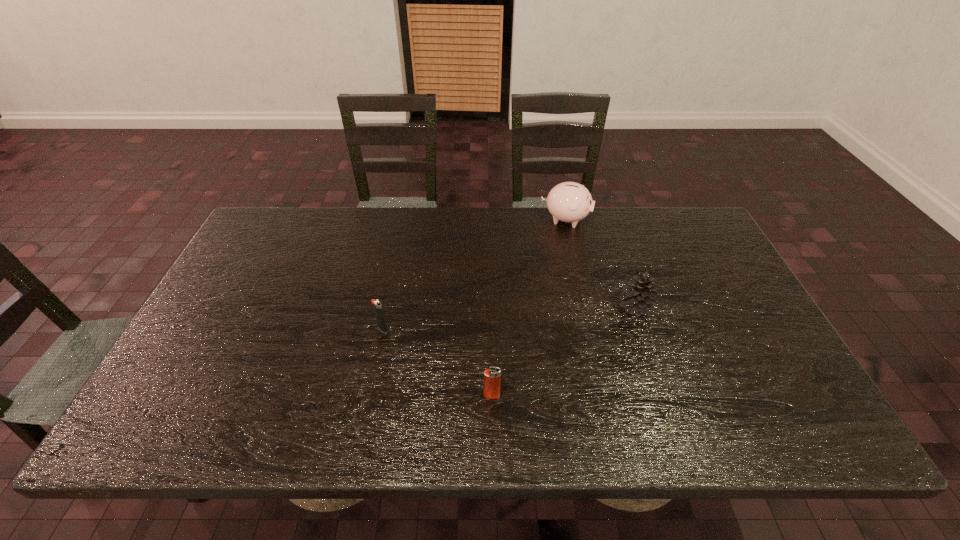
Where is `free space between the farthest object and the left igniter`? Image resolution: width=960 pixels, height=540 pixels. free space between the farthest object and the left igniter is located at coordinates (474, 274).

The height and width of the screenshot is (540, 960). I want to click on vacant space that is in between the third object from left to right and the farther igniter, so click(x=474, y=274).

This screenshot has height=540, width=960. Find the location of `vacant point located between the farthest object and the nearest object`. vacant point located between the farthest object and the nearest object is located at coordinates (529, 307).

Where is `vacant point located between the rightmost object and the second object from right to left`? The width and height of the screenshot is (960, 540). vacant point located between the rightmost object and the second object from right to left is located at coordinates (600, 263).

The height and width of the screenshot is (540, 960). Find the location of `empty space that is in between the third nearest object and the nearest object`. empty space that is in between the third nearest object and the nearest object is located at coordinates (564, 351).

The width and height of the screenshot is (960, 540). I want to click on free space between the rightmost object and the leftmost object, so click(x=509, y=318).

Locate an element on the screen. The height and width of the screenshot is (540, 960). unoccupied position between the third object from left to right and the rightmost object is located at coordinates (600, 263).

The width and height of the screenshot is (960, 540). I want to click on empty location between the second object from right to left and the pinecone, so click(600, 263).

Image resolution: width=960 pixels, height=540 pixels. I want to click on the third closest object to the nearer igniter, so click(x=570, y=202).

Locate an element on the screen. This screenshot has width=960, height=540. object that is the closest to the farthest object is located at coordinates (638, 296).